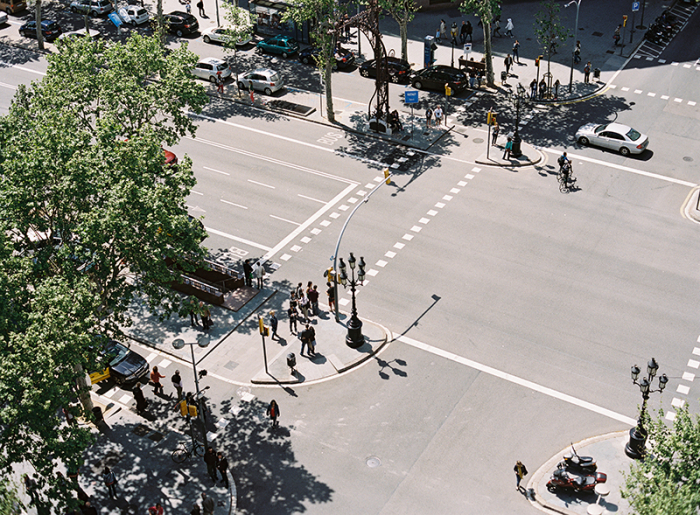
At what (x,y) coordinates should I click in order to perform the action: click on lamp. Please return your answer as a coordinate pair (x, y). Looking at the image, I should click on (645, 393).